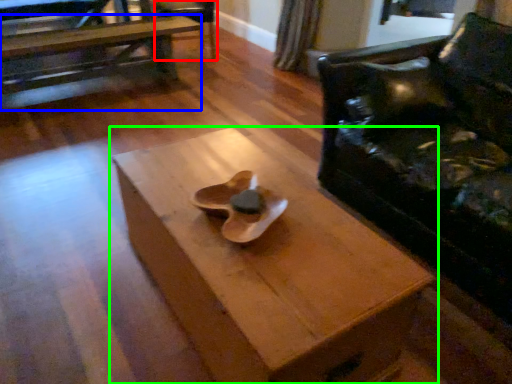
Question: Estimate the real-world distances between objects in this image. Which object is closer to armchair (highlighted by a red box), table (highlighted by a blue box) or table (highlighted by a green box)?

Choices:
 (A) table
 (B) table

Answer: (A)